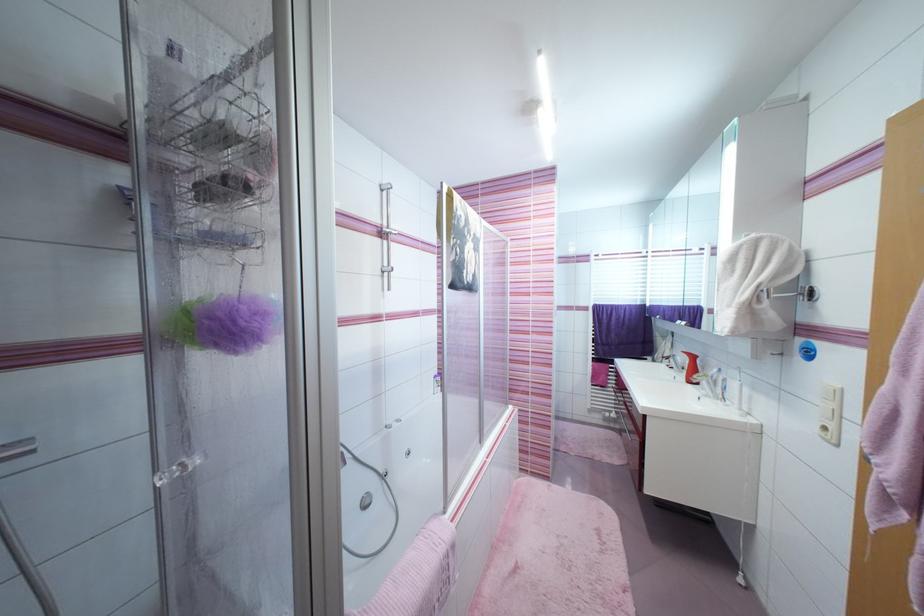
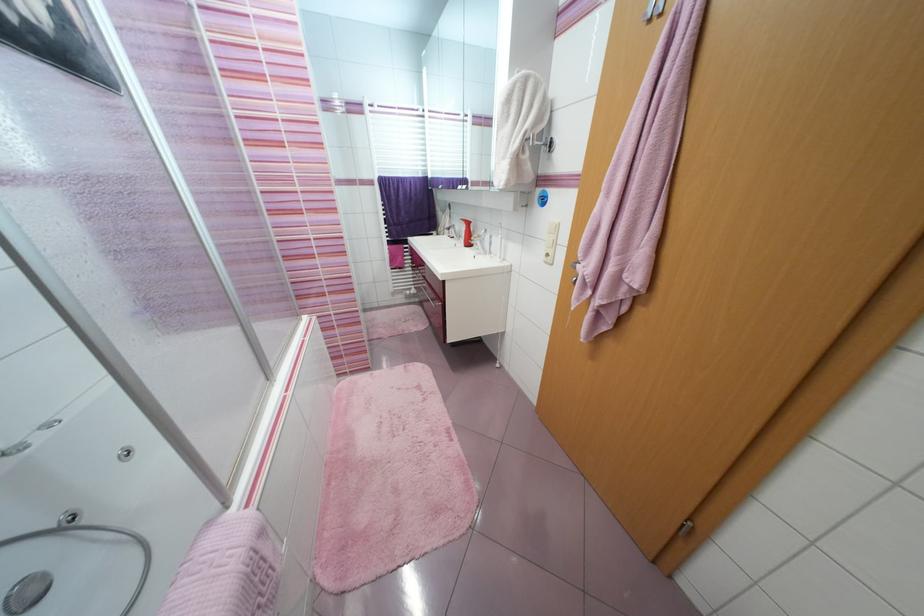
The point at (689, 376) is marked in the first image. Where is the corresponding point in the second image?

(468, 241)